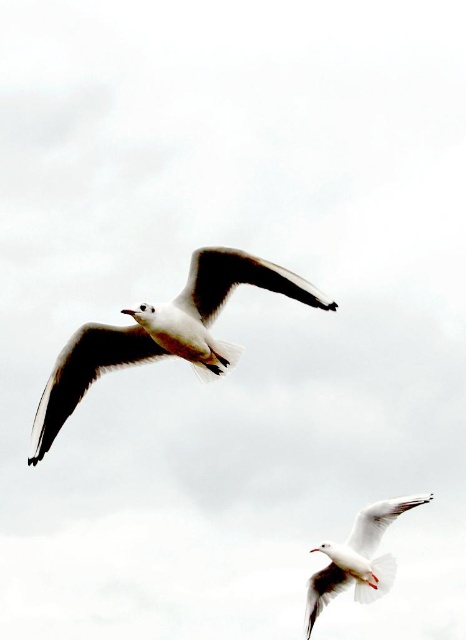
Is white feathered bird at upper center closer to the viewer compared to white feathered bird at lower right?

Yes, white feathered bird at upper center is in front of white feathered bird at lower right.

Is white feathered bird at upper center to the left of white feathered bird at lower right from the viewer's perspective?

Indeed, white feathered bird at upper center is positioned on the left side of white feathered bird at lower right.

Does point (244, 264) come behind point (379, 564)?

No, (244, 264) is in front of (379, 564).

You are a GUI agent. You are given a task and a screenshot of the screen. Output one action in this format:
    pyautogui.click(x=<x>, y=<y>)
    Task: Click on the white feathered bird at upper center
    This screenshot has height=640, width=466.
    Given the screenshot: What is the action you would take?
    pyautogui.click(x=162, y=332)